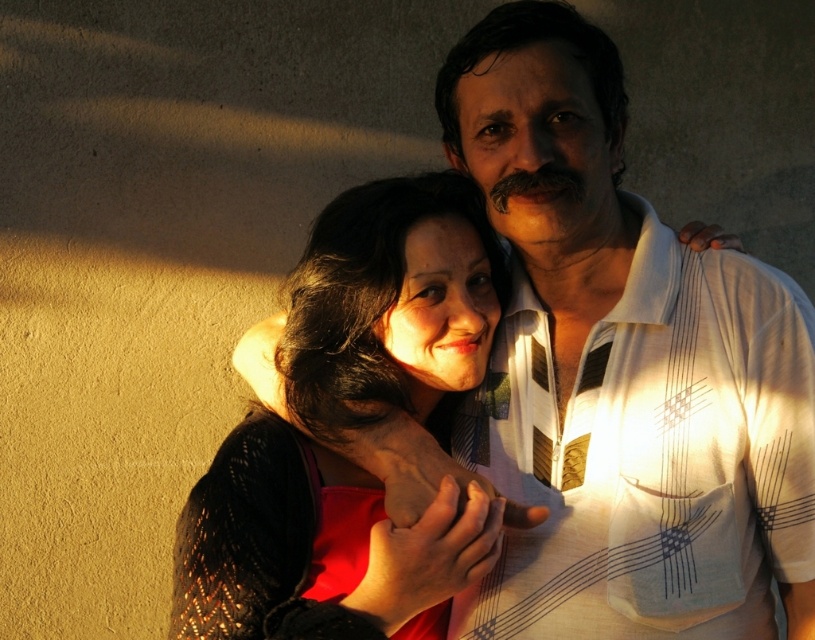
Does white striped shirt at center have a smaller size compared to matte black sweater at center?

Yes.

Is white striped shirt at center to the left of matte black sweater at center from the viewer's perspective?

No, white striped shirt at center is not to the left of matte black sweater at center.

The width and height of the screenshot is (815, 640). I want to click on white striped shirt at center, so click(620, 368).

The height and width of the screenshot is (640, 815). I want to click on white striped shirt at center, so click(x=620, y=368).